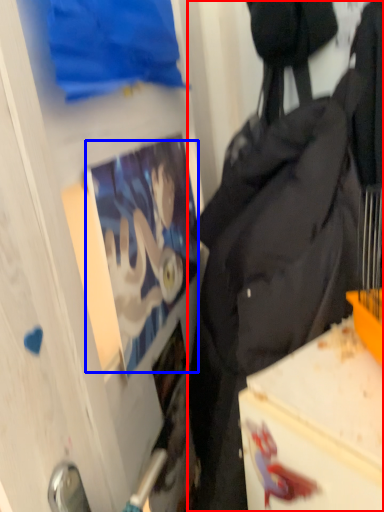
Question: Which object appears farthest to the camera in this image, backpack (highlighted by a red box) or person (highlighted by a blue box)?

Choices:
 (A) backpack
 (B) person

Answer: (B)